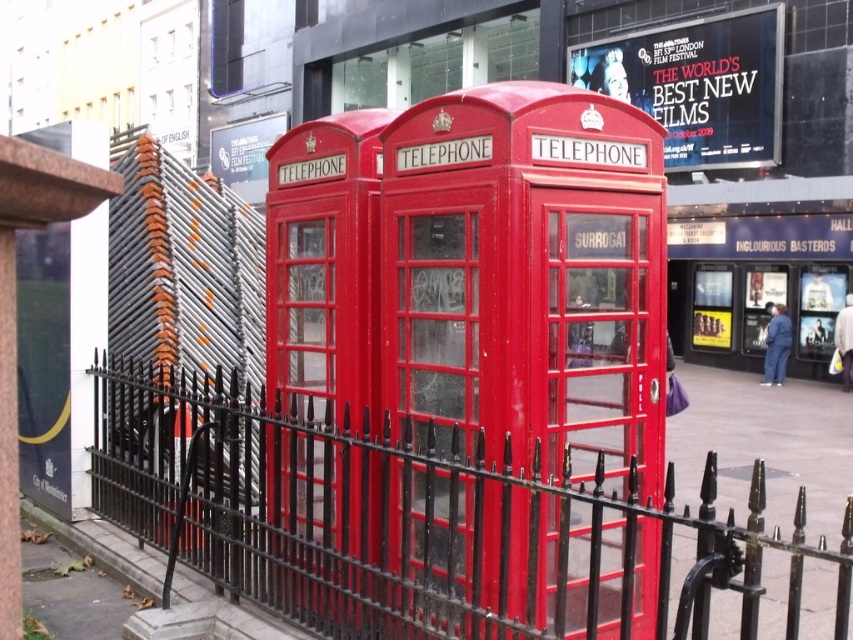
Question: Which object is farther from the camera taking this photo?

Choices:
 (A) matte red telephone booth at center
 (B) black wrought iron fence at lower left

Answer: (A)

Question: Can you confirm if matte red telephone booth at center is thinner than black wrought iron fence at lower left?

Choices:
 (A) no
 (B) yes

Answer: (B)

Question: Can you confirm if matte red telephone booth at center is positioned above black wrought iron fence at lower left?

Choices:
 (A) yes
 (B) no

Answer: (A)

Question: Does matte red telephone booth at center have a smaller size compared to black wrought iron fence at lower left?

Choices:
 (A) yes
 (B) no

Answer: (A)